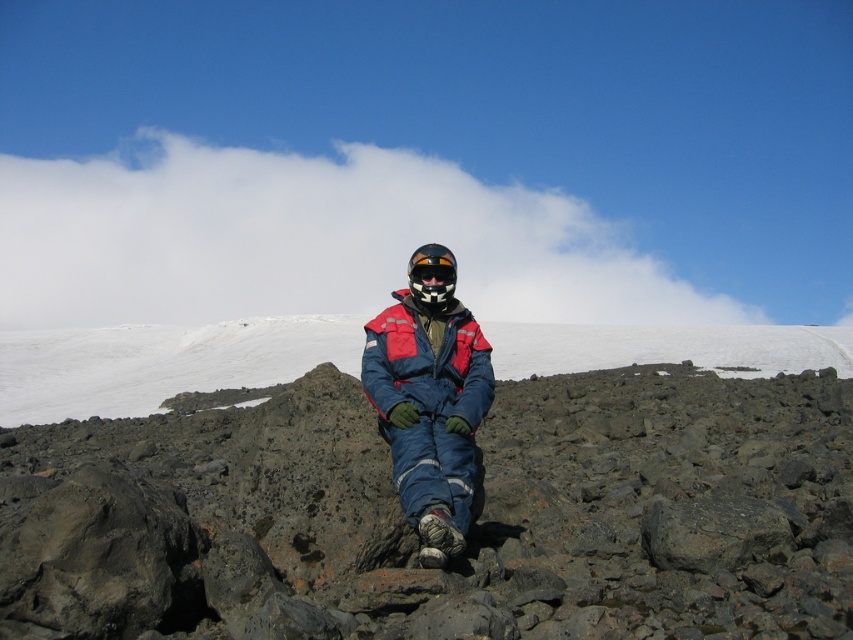
Question: Can you confirm if blue fabric jumpsuit at center is smaller than black matte helmet at center?

Choices:
 (A) yes
 (B) no

Answer: (B)

Question: Is matte blue jacket at center thinner than black matte goggles at center?

Choices:
 (A) yes
 (B) no

Answer: (B)

Question: Which object is the closest to the black matte goggles at center?

Choices:
 (A) matte blue jacket at center
 (B) black matte helmet at center

Answer: (B)

Question: Is matte blue jacket at center to the left of black matte helmet at center from the viewer's perspective?

Choices:
 (A) no
 (B) yes

Answer: (A)

Question: Estimate the real-world distances between objects in this image. Which object is farther from the matte blue jacket at center?

Choices:
 (A) white fluffy cloud at upper center
 (B) black matte helmet at center
 (C) smooth volcanic rock at center
 (D) blue fabric jumpsuit at center

Answer: (A)

Question: Which object is closer to the camera taking this photo?

Choices:
 (A) blue fabric jumpsuit at center
 (B) matte blue jacket at center

Answer: (A)